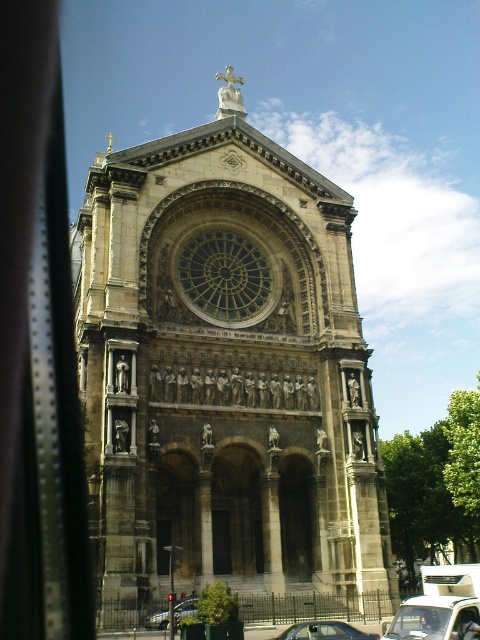
You are a photographer standing in front of the historic church. You notice two silver metallic cars parked near the entrance. Which car would appear closer to you when taking a photo of the church facade? Please choose between the silver metallic car at lower center and the metallic silver car at lower left.

The silver metallic car at lower center appears closer because it is larger in size than the metallic silver car at lower left, and in photography, larger objects in the frame typically indicate closer proximity.

You are a photographer standing outside a car, looking at the stone cathedral at center through the transparent glass car window at lower right. Can you tell me which object is bigger in your view?

The stone cathedral at center has a larger size compared to the transparent glass car window at lower right, so the stone cathedral at center appears bigger in your view.

You are standing in front of the church and notice a silver metallic car at lower center and a transparent glass car window at lower right. Which object is taller?

The transparent glass car window at lower right is taller than the silver metallic car at lower center.